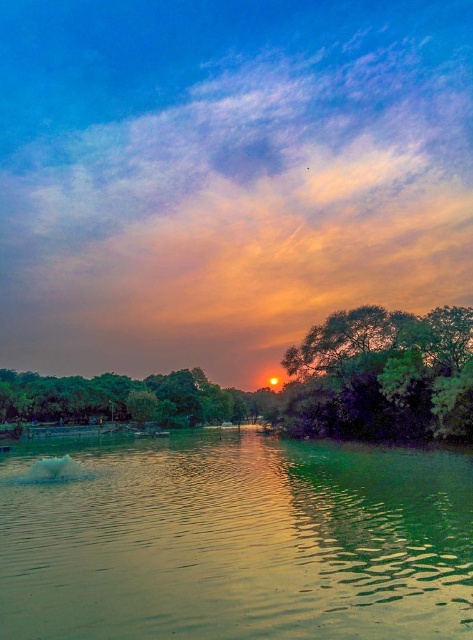
Question: Does green smooth water at center lie in front of green leafy tree at center?

Choices:
 (A) yes
 (B) no

Answer: (A)

Question: Does green leafy tree at center appear on the right side of green leafy trees at center?

Choices:
 (A) yes
 (B) no

Answer: (A)

Question: Is green smooth water at center positioned behind green leafy tree at center?

Choices:
 (A) yes
 (B) no

Answer: (B)

Question: Based on their relative distances, which object is farther from the green leafy trees at center?

Choices:
 (A) green smooth water at center
 (B) green leafy tree at center

Answer: (A)

Question: Which of the following is the closest to the observer?

Choices:
 (A) green leafy trees at center
 (B) green smooth water at center

Answer: (B)

Question: Which of the following is the closest to the observer?

Choices:
 (A) (73, 417)
 (B) (384, 326)

Answer: (B)